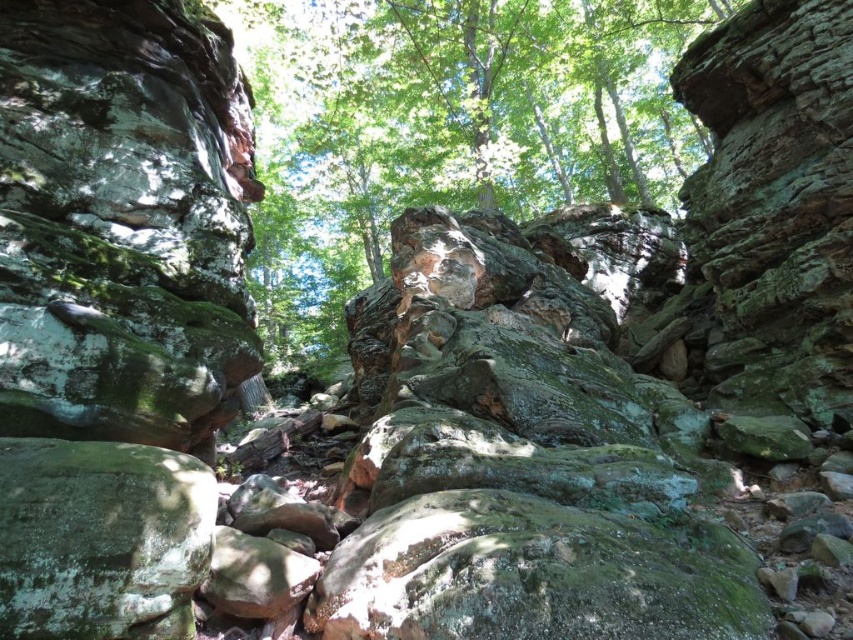
Between point (701, 24) and point (161, 566), which one is positioned in front?

Point (161, 566)

In the scene shown: Does green mossy rock at center have a lesser width compared to green mossy rock at lower left?

In fact, green mossy rock at center might be wider than green mossy rock at lower left.

Which is behind, point (263, 269) or point (3, 448)?

Point (263, 269)

Identify the location of green mossy rock at center. (448, 124).